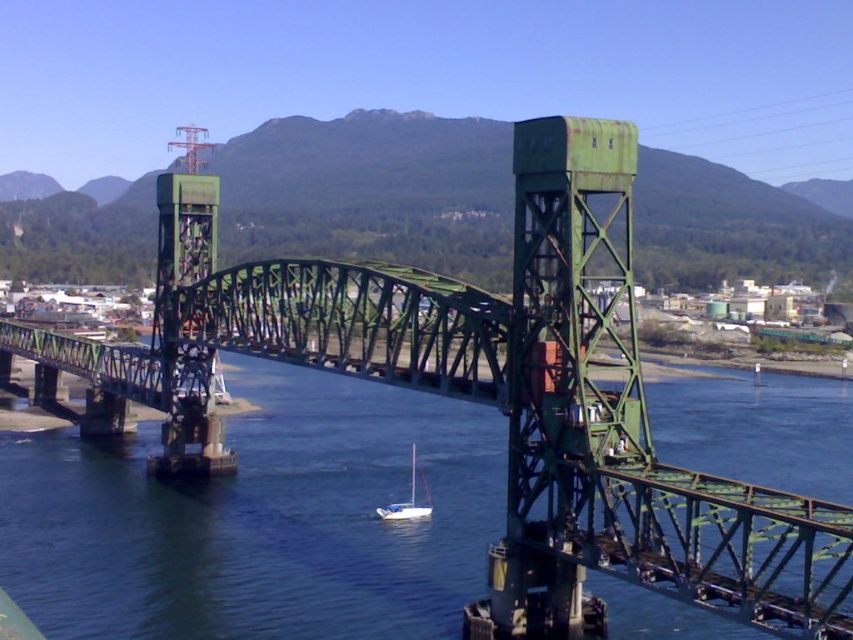
Looking at this image, measure the distance from blue water at center to white matte sailboat at center.

blue water at center and white matte sailboat at center are 28.24 meters apart from each other.

The image size is (853, 640). Identify the location of blue water at center. (260, 520).

Image resolution: width=853 pixels, height=640 pixels. Find the location of `blue water at center`. blue water at center is located at coordinates (260, 520).